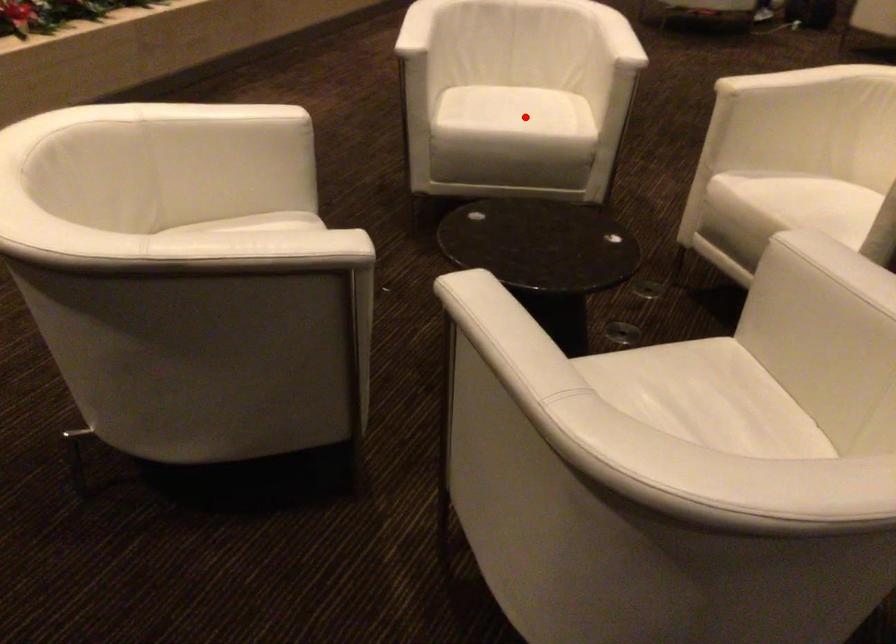
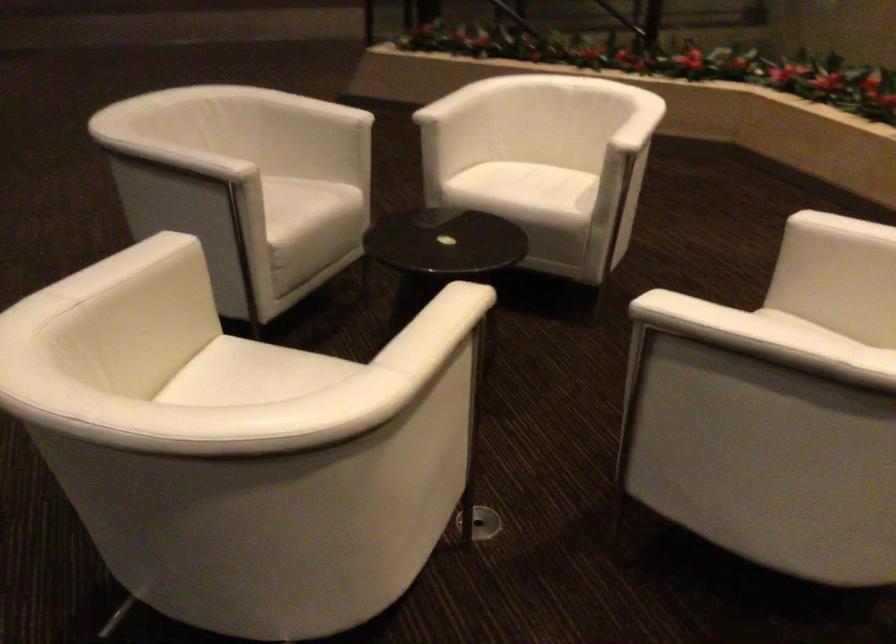
Question: I am providing you with two images of the same scene from different viewpoints. A red point is marked on the first image. At the location where the point appears in image 1, is it still visible in image 2?

Choices:
 (A) Yes
 (B) No

Answer: (B)